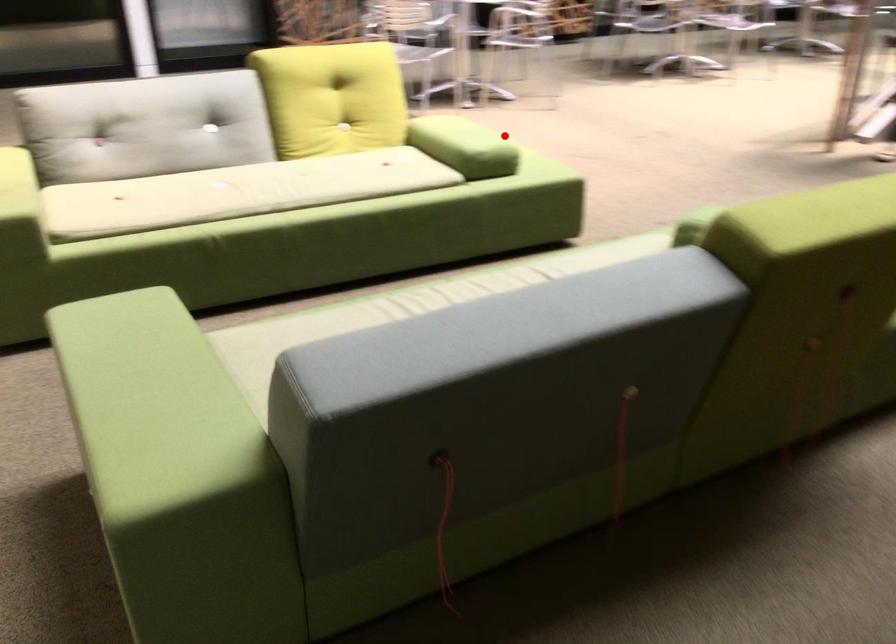
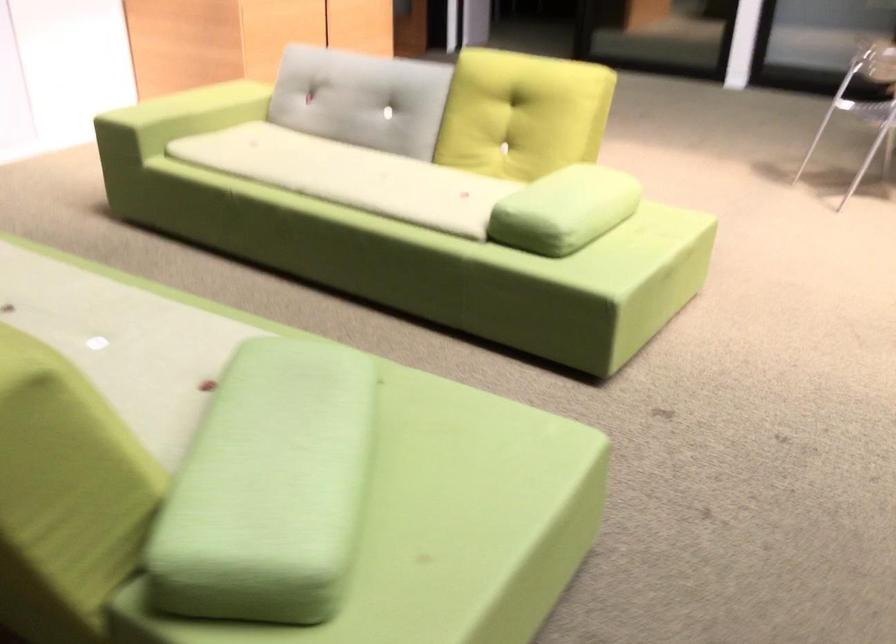
Question: I am providing you with two images of the same scene from different viewpoints. Image1 has a red point marked. In image2, the corresponding 3D location appears at what relative position? Reply with the corresponding letter.

Choices:
 (A) Closer
 (B) Farther

Answer: (A)